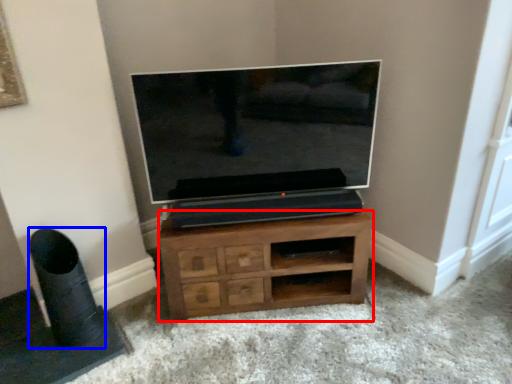
Question: Which object is closer to the camera taking this photo, chest of drawers (highlighted by a red box) or speaker (highlighted by a blue box)?

Choices:
 (A) chest of drawers
 (B) speaker

Answer: (B)